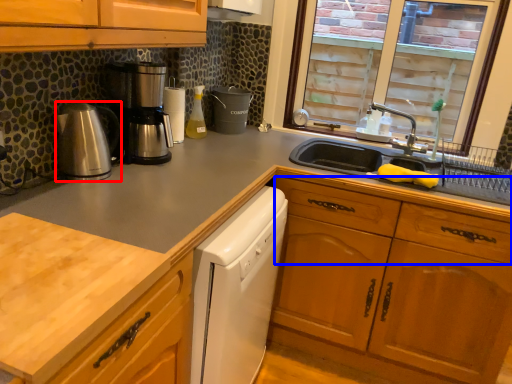
Question: Which object is closer to the camera taking this photo, kitchen appliance (highlighted by a red box) or drawer (highlighted by a blue box)?

Choices:
 (A) kitchen appliance
 (B) drawer

Answer: (A)